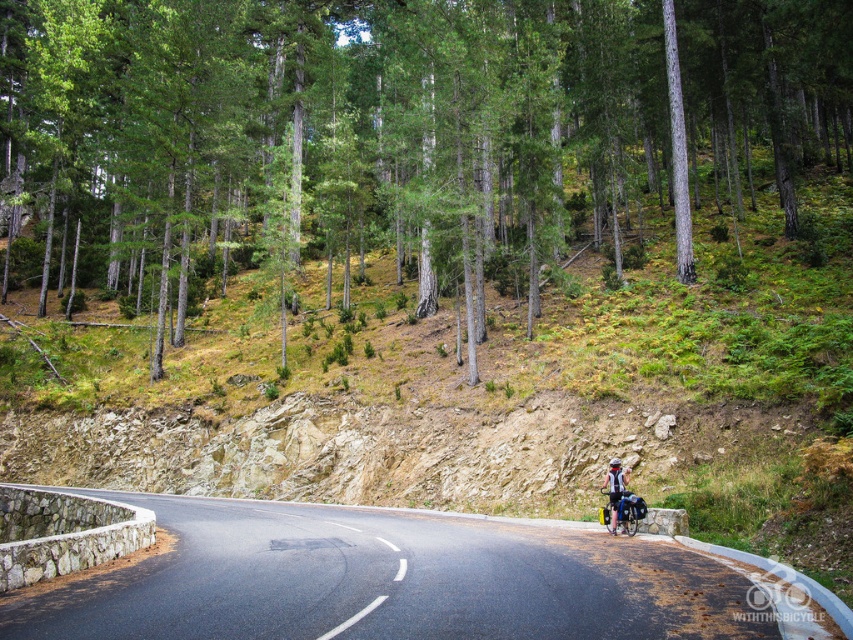
Question: Which point is closer to the camera?

Choices:
 (A) light blue fabric backpack at center
 (B) silver metallic bicycle at center
 (C) black asphalt road at center

Answer: (C)

Question: Does green/smooth tree at center have a larger size compared to light blue fabric backpack at center?

Choices:
 (A) yes
 (B) no

Answer: (A)

Question: Which point is closer to the camera?

Choices:
 (A) (477, 298)
 (B) (624, 528)
 (C) (299, 563)

Answer: (C)

Question: Can you confirm if silver metallic bicycle at center is thinner than light blue fabric backpack at center?

Choices:
 (A) no
 (B) yes

Answer: (A)

Question: Estimate the real-world distances between objects in this image. Which object is farther from the black asphalt road at center?

Choices:
 (A) light blue fabric backpack at center
 (B) silver metallic bicycle at center
 (C) green/smooth tree at center

Answer: (C)

Question: From the image, what is the correct spatial relationship of green/smooth tree at center in relation to light blue fabric backpack at center?

Choices:
 (A) above
 (B) below

Answer: (A)